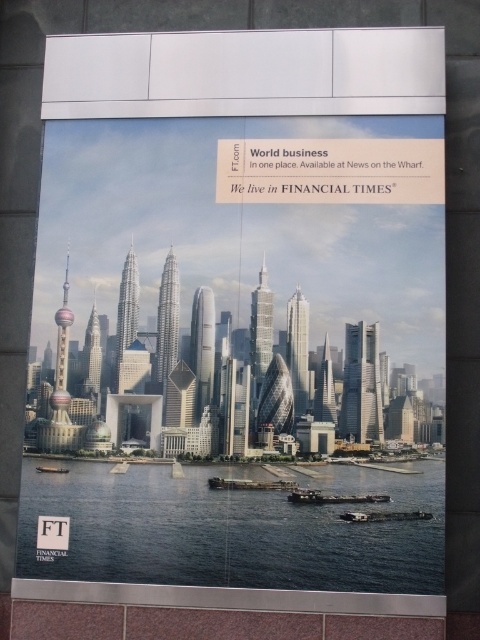
Question: Which object is closer to the camera taking this photo?

Choices:
 (A) metallic gray boat at lower left
 (B) metallic glass skyscrapers at center
 (C) dark blue water at lower center

Answer: (C)

Question: Which of the following is the farthest from the observer?

Choices:
 (A) (393, 564)
 (B) (63, 472)
 (C) (273, 214)

Answer: (C)

Question: Which point is closer to the camera taking this photo?

Choices:
 (A) (362, 499)
 (B) (175, 172)
 (C) (136, 568)

Answer: (A)

Question: Is metallic glass skyscrapers at center above metallic gray barge at lower center?

Choices:
 (A) yes
 (B) no

Answer: (A)

Question: Observing the image, what is the correct spatial positioning of metallic gray boat at lower center in reference to metallic gray boat at lower left?

Choices:
 (A) right
 (B) left

Answer: (A)

Question: Is metallic gray boat at lower center below metallic gray boat at lower left?

Choices:
 (A) no
 (B) yes

Answer: (B)